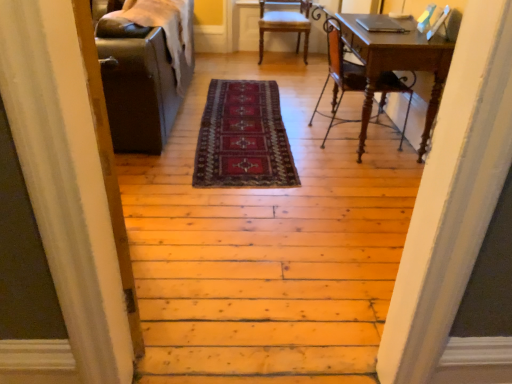
Question: From the image's perspective, is wooden desk at right beneath wooden chair at center, the second chair when ordered from front to back?

Choices:
 (A) yes
 (B) no

Answer: (A)

Question: Does wooden desk at right touch wooden chair at center, arranged as the 1th chair when viewed from the back?

Choices:
 (A) no
 (B) yes

Answer: (A)

Question: Is wooden desk at right taller than wooden chair at center, the second chair when ordered from front to back?

Choices:
 (A) yes
 (B) no

Answer: (A)

Question: Is the position of wooden desk at right more distant than that of wooden chair at center, which appears as the 2th chair when ordered from the bottom?

Choices:
 (A) yes
 (B) no

Answer: (B)

Question: Can you confirm if wooden desk at right is thinner than wooden chair at center, the first chair in the top-to-bottom sequence?

Choices:
 (A) yes
 (B) no

Answer: (A)

Question: Do you think wooden desk at right is within wooden chair at right, the second chair from the top, or outside of it?

Choices:
 (A) outside
 (B) inside

Answer: (B)

Question: Looking at their shapes, would you say wooden desk at right is wider or thinner than wooden chair at right, the second chair from the top?

Choices:
 (A) wide
 (B) thin

Answer: (B)

Question: From a real-world perspective, relative to wooden chair at right, the 1th chair positioned from the bottom, is wooden desk at right vertically above or below?

Choices:
 (A) below
 (B) above

Answer: (A)

Question: Is point (437, 43) closer or farther from the camera than point (409, 92)?

Choices:
 (A) farther
 (B) closer

Answer: (B)

Question: Does point (229, 163) appear closer or farther from the camera than point (338, 87)?

Choices:
 (A) closer
 (B) farther

Answer: (A)

Question: From a real-world perspective, is dark red woven rug at center physically located above or below wooden chair at right, which is the 1th chair from front to back?

Choices:
 (A) below
 (B) above

Answer: (A)

Question: Looking at the image, does dark red woven rug at center seem bigger or smaller compared to wooden chair at right, placed as the second chair when sorted from back to front?

Choices:
 (A) small
 (B) big

Answer: (A)

Question: From the image's perspective, relative to wooden chair at right, the second chair from the top, is dark red woven rug at center above or below?

Choices:
 (A) above
 (B) below

Answer: (B)

Question: Considering the relative positions of wooden desk at right and dark red woven rug at center in the image provided, is wooden desk at right to the left or to the right of dark red woven rug at center?

Choices:
 (A) left
 (B) right

Answer: (B)

Question: Is wooden desk at right inside or outside of dark red woven rug at center?

Choices:
 (A) inside
 (B) outside

Answer: (B)